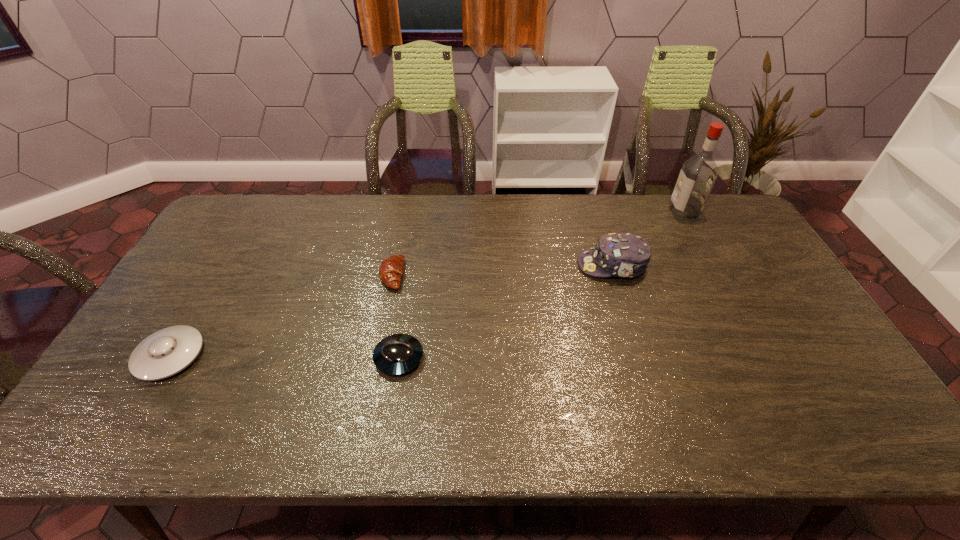
Where is `object at the far right corner`? object at the far right corner is located at coordinates (698, 174).

Where is `vacant space at the far edge`? The height and width of the screenshot is (540, 960). vacant space at the far edge is located at coordinates (667, 198).

Where is `free space at the near edge of the desktop`? The image size is (960, 540). free space at the near edge of the desktop is located at coordinates pyautogui.click(x=214, y=436).

The image size is (960, 540). In the image, there is a desktop. Identify the location of free space at the left edge. (114, 398).

Where is `vacant area at the right edge of the desktop`? Image resolution: width=960 pixels, height=540 pixels. vacant area at the right edge of the desktop is located at coordinates (763, 330).

I want to click on free area in between the crescent roll and the tallest object, so click(539, 243).

I want to click on vacant space that's between the second tallest object and the crescent roll, so click(x=502, y=270).

The image size is (960, 540). I want to click on blank region between the shorter saucer and the second object from right to left, so click(506, 312).

The image size is (960, 540). In order to click on free space between the shorter saucer and the left saucer in this screenshot , I will do `click(284, 357)`.

Find the location of a particular element. free space that is in between the headwear and the leftmost object is located at coordinates (392, 310).